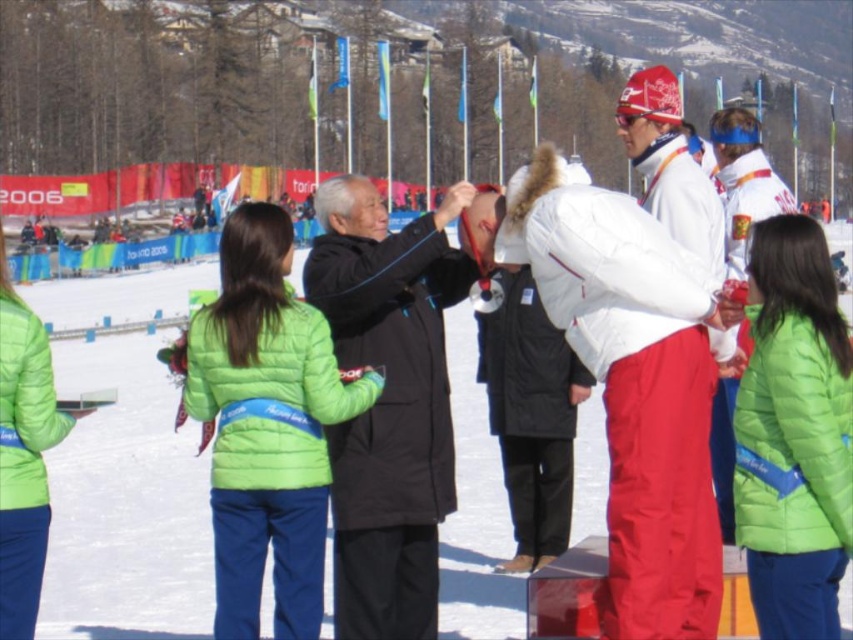
Looking at this image, is the position of black matte jacket at center less distant than that of green matte jacket at center?

No.

The width and height of the screenshot is (853, 640). I want to click on black matte jacket at center, so click(x=387, y=403).

Between white snow at center and green matte jacket at center, which one is positioned higher?

white snow at center

Who is taller, white snow at center or green matte jacket at center?

Standing taller between the two is white snow at center.

What are the coordinates of `white snow at center` in the screenshot? It's located at (125, 467).

Can you confirm if white snow at center is bigger than black matte jacket at center?

Indeed, white snow at center has a larger size compared to black matte jacket at center.

Which is in front, point (53, 499) or point (340, 365)?

Positioned in front is point (340, 365).

Locate an element on the screen. This screenshot has height=640, width=853. white snow at center is located at coordinates (125, 467).